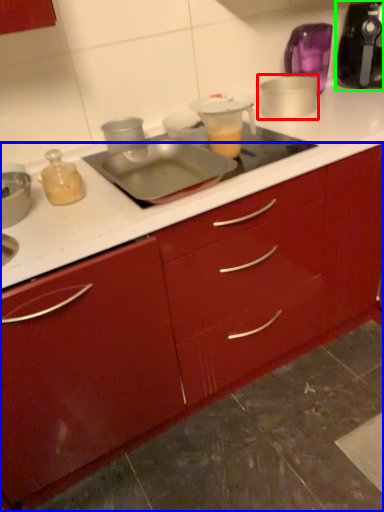
Question: Which object is positioned farthest from appliance (highlighted by a red box)? Select from cabinetry (highlighted by a blue box) and kitchen appliance (highlighted by a green box).

Choices:
 (A) cabinetry
 (B) kitchen appliance

Answer: (A)